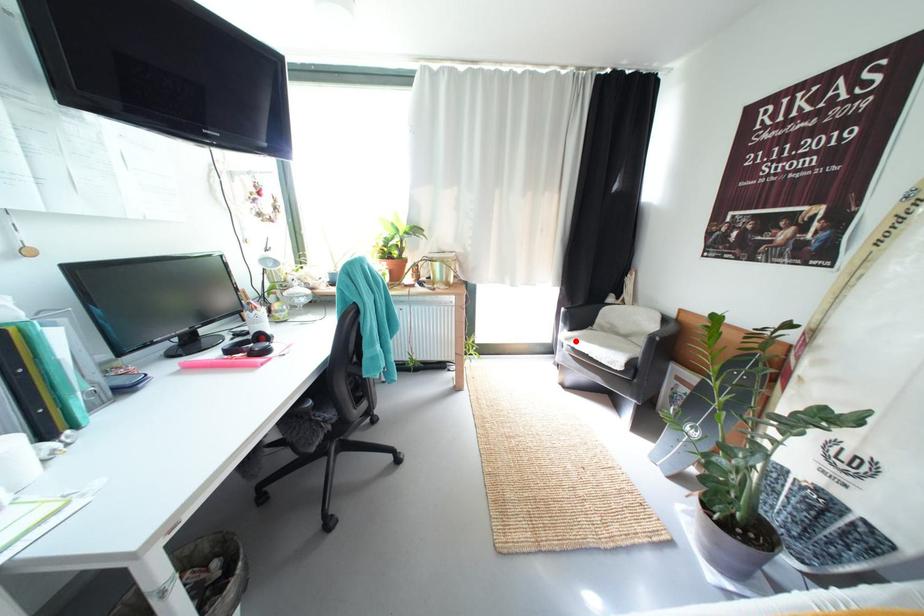
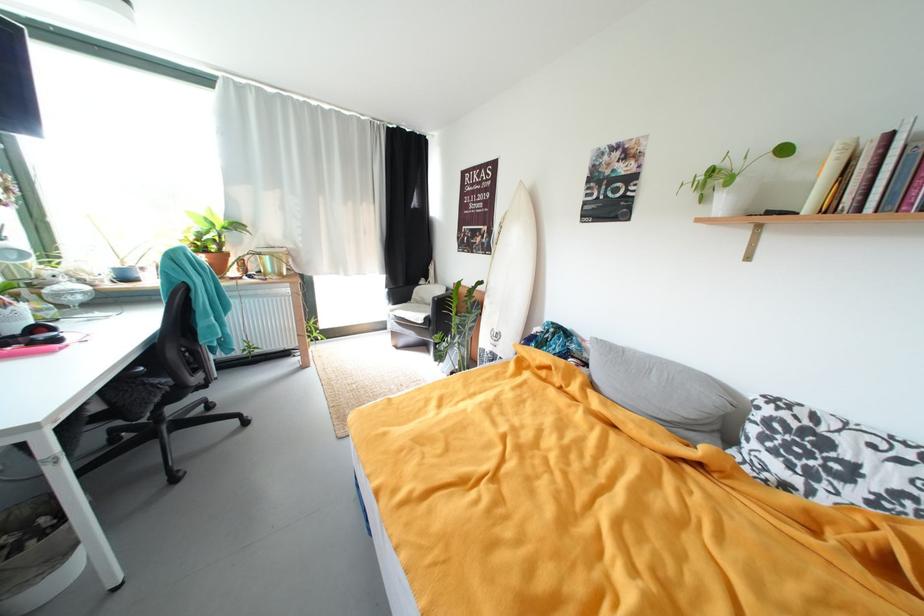
Question: I am providing you with two images of the same scene from different viewpoints. Given a red point in image1, look at the same physical point in image2. Is it:

Choices:
 (A) Closer to the viewpoint
 (B) Farther from the viewpoint

Answer: (B)